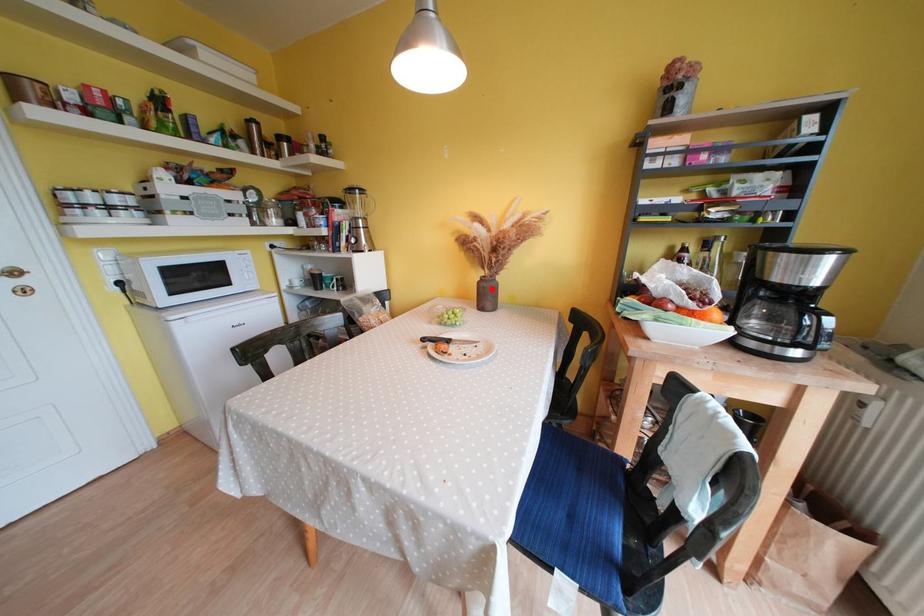
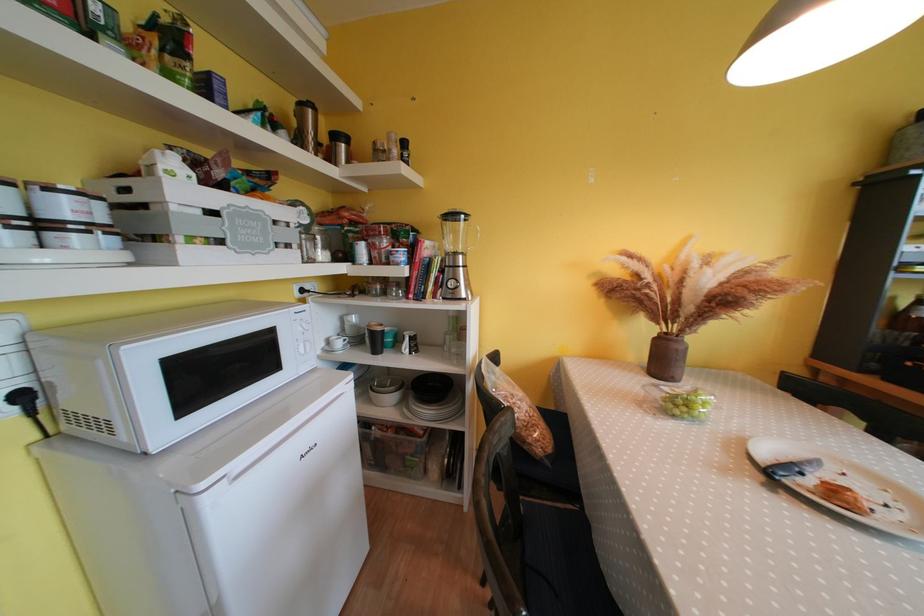
Question: I am providing you with two images of the same scene from different viewpoints. A red point is marked on the first image. At the location where the point appears in image 1, is it still visible in image 2?

Choices:
 (A) Yes
 (B) No

Answer: (A)